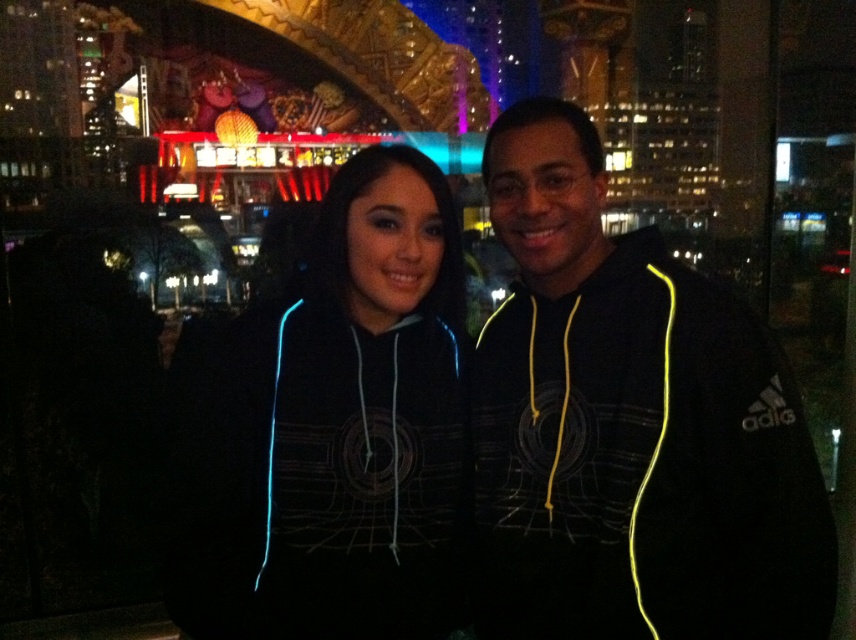
Question: Is black/yellow hoodie at right below black fleece hoodie at center?

Choices:
 (A) no
 (B) yes

Answer: (A)

Question: Is black/yellow hoodie at right smaller than black fleece hoodie at center?

Choices:
 (A) yes
 (B) no

Answer: (B)

Question: Which point is closer to the camera?

Choices:
 (A) black/yellow hoodie at right
 (B) black fleece hoodie at center

Answer: (A)

Question: Among these points, which one is farthest from the camera?

Choices:
 (A) (345, 563)
 (B) (727, 400)

Answer: (A)

Question: Is black/yellow hoodie at right smaller than black fleece hoodie at center?

Choices:
 (A) no
 (B) yes

Answer: (A)

Question: Which point is closer to the camera?

Choices:
 (A) (596, 195)
 (B) (334, 378)

Answer: (B)